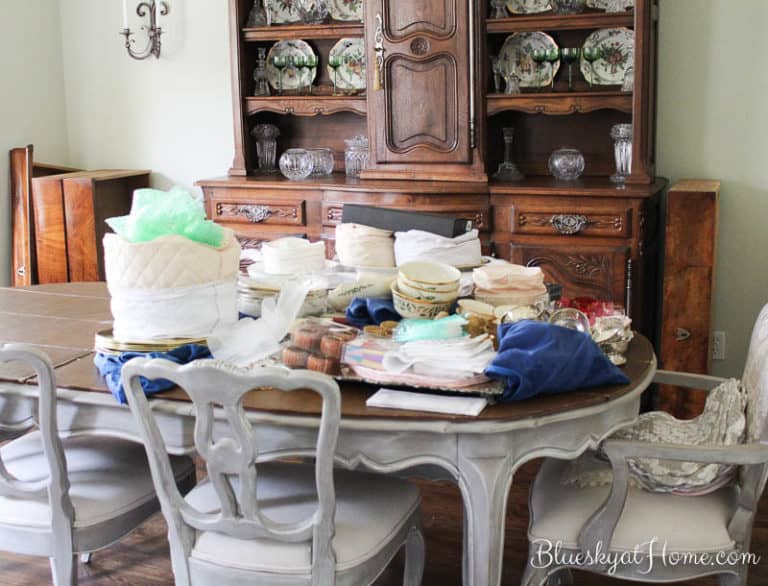
Find the location of a particular element. The width and height of the screenshot is (768, 586). decorated bowls is located at coordinates (409, 299), (415, 292), (435, 284).